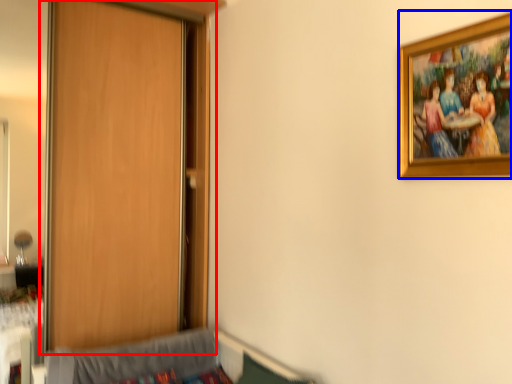
Question: Which object is closer to the camera taking this photo, door (highlighted by a red box) or picture frame (highlighted by a blue box)?

Choices:
 (A) door
 (B) picture frame

Answer: (B)